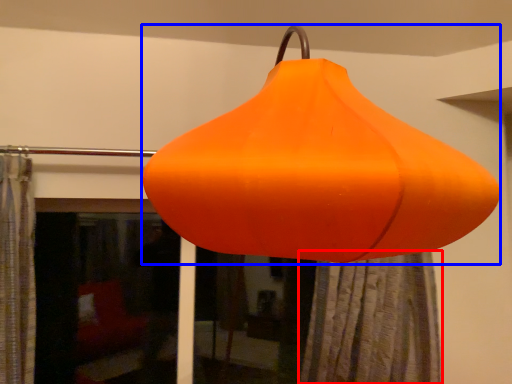
Question: Which of the following is the farthest to the observer, shower curtain (highlighted by a red box) or lantern (highlighted by a blue box)?

Choices:
 (A) shower curtain
 (B) lantern

Answer: (A)